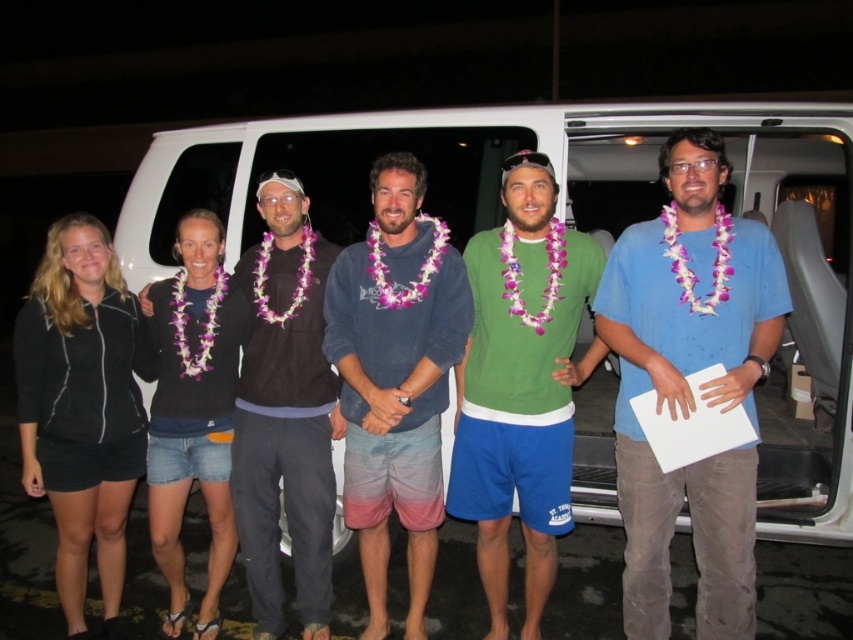
Question: From the image, what is the correct spatial relationship of white matte van at center in relation to black denim shorts at center?

Choices:
 (A) above
 (B) below

Answer: (A)

Question: Does blue cotton shirt at center have a smaller size compared to black sweater at center?

Choices:
 (A) yes
 (B) no

Answer: (B)

Question: Which point is farther to the camera?

Choices:
 (A) black fleece jacket at left
 (B) green matte shirt at center

Answer: (A)

Question: Does green matte shirt at center have a smaller size compared to black sweater at center?

Choices:
 (A) yes
 (B) no

Answer: (B)

Question: Which is nearer to the black denim shorts at center?

Choices:
 (A) white matte van at center
 (B) blue cotton shirt at center

Answer: (A)

Question: Estimate the real-world distances between objects in this image. Which object is farther from the white matte van at center?

Choices:
 (A) black denim shorts at center
 (B) blue cotton shirt at center

Answer: (B)